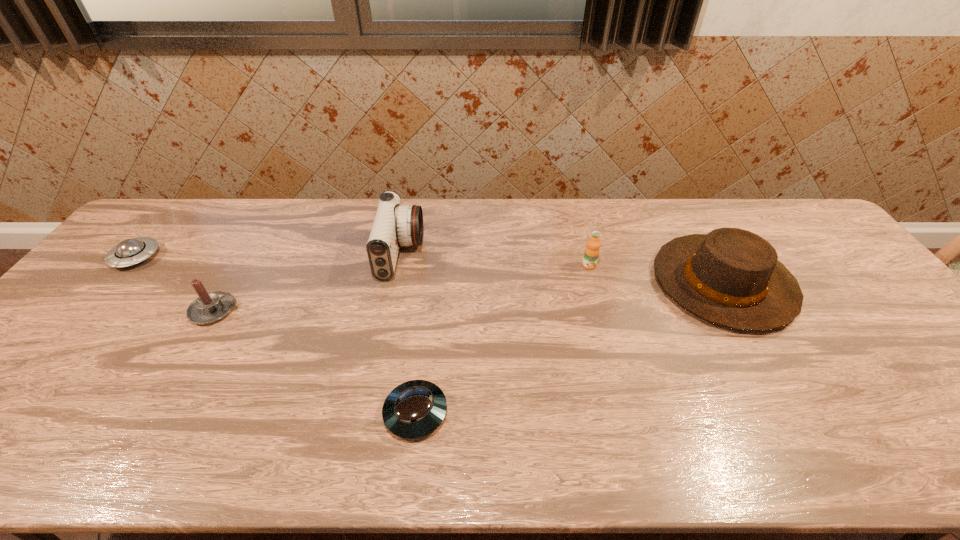
Image resolution: width=960 pixels, height=540 pixels. Find the location of `free location located 0.060m on the label of the fifth object from left to right`. free location located 0.060m on the label of the fifth object from left to right is located at coordinates (594, 285).

Where is `free region located 0.310m on the side of the second object from left to right with the handle loop`? Image resolution: width=960 pixels, height=540 pixels. free region located 0.310m on the side of the second object from left to right with the handle loop is located at coordinates (355, 310).

The image size is (960, 540). I want to click on vacant space situated on the front of the fifth tallest object, so click(x=28, y=385).

At what (x,y) coordinates should I click in order to perform the action: click on free space located 0.170m on the left of the right saucer. Please return your answer as a coordinate pair (x, y). Image resolution: width=960 pixels, height=540 pixels. Looking at the image, I should click on (307, 413).

You are a GUI agent. You are given a task and a screenshot of the screen. Output one action in this format:
    pyautogui.click(x=<x>, y=<y>)
    Task: Click on the camcorder that is at the far edge
    
    Given the screenshot: What is the action you would take?
    pyautogui.click(x=394, y=225)

Where is `cowboy hat situated at the far edge`? cowboy hat situated at the far edge is located at coordinates (731, 277).

What are the coordinates of `object that is at the near edge` in the screenshot? It's located at (414, 409).

You are a GUI agent. You are given a task and a screenshot of the screen. Output one action in this format:
    pyautogui.click(x=<x>, y=<y>)
    Task: Click on the object positioned at the left edge
    The image size is (960, 540).
    Given the screenshot: What is the action you would take?
    pyautogui.click(x=128, y=252)

In the image, there is a desktop. Where is `free region at the far edge`? Image resolution: width=960 pixels, height=540 pixels. free region at the far edge is located at coordinates (268, 241).

I want to click on vacant space at the near edge of the desktop, so click(155, 459).